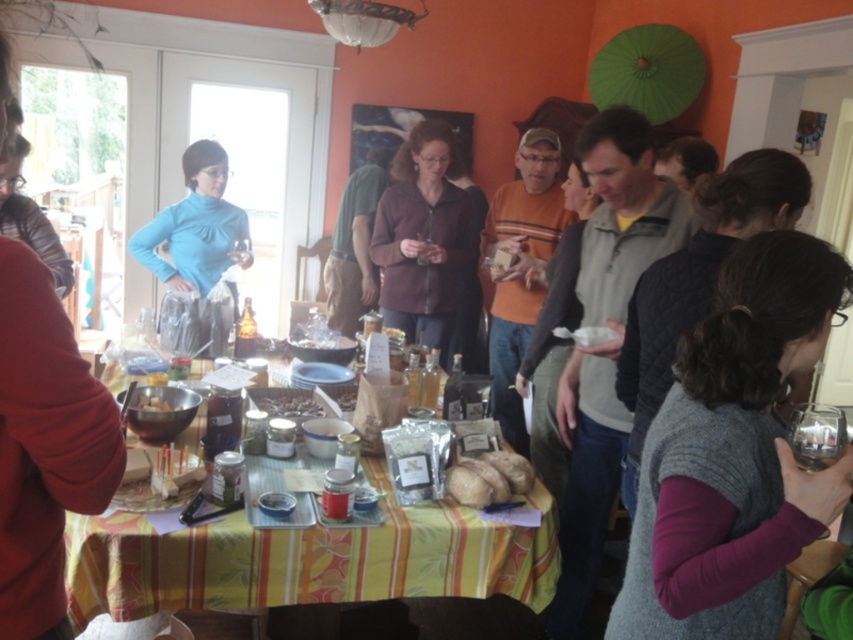
Does gray knitted vest at lower right lie behind smooth brown nuts at center?

That is False.

Based on the photo, does gray knitted vest at lower right have a greater width compared to smooth brown nuts at center?

Indeed, gray knitted vest at lower right has a greater width compared to smooth brown nuts at center.

Between point (685, 428) and point (287, 396), which one is positioned behind?

The point (287, 396) is more distant.

Where is `gray knitted vest at lower right`? gray knitted vest at lower right is located at coordinates (733, 452).

Is smooth brown potato at center taller than matte brown bowl at center?

Yes.

Does smooth brown potato at center appear over matte brown bowl at center?

No, smooth brown potato at center is not above matte brown bowl at center.

Is point (515, 467) positioned after point (155, 410)?

No, it is in front of (155, 410).

Find the location of a particular element. This screenshot has width=853, height=640. smooth brown potato at center is located at coordinates (489, 477).

Does smooth brown nuts at center appear on the right side of matte brown bowl at center?

Correct, you'll find smooth brown nuts at center to the right of matte brown bowl at center.

Is smooth brown nuts at center further to camera compared to matte brown bowl at center?

Yes, smooth brown nuts at center is further from the viewer.

Is point (291, 397) more distant than point (160, 400)?

Yes, point (291, 397) is farther from viewer.

Where is `smooth brown nuts at center`? The height and width of the screenshot is (640, 853). smooth brown nuts at center is located at coordinates (289, 404).